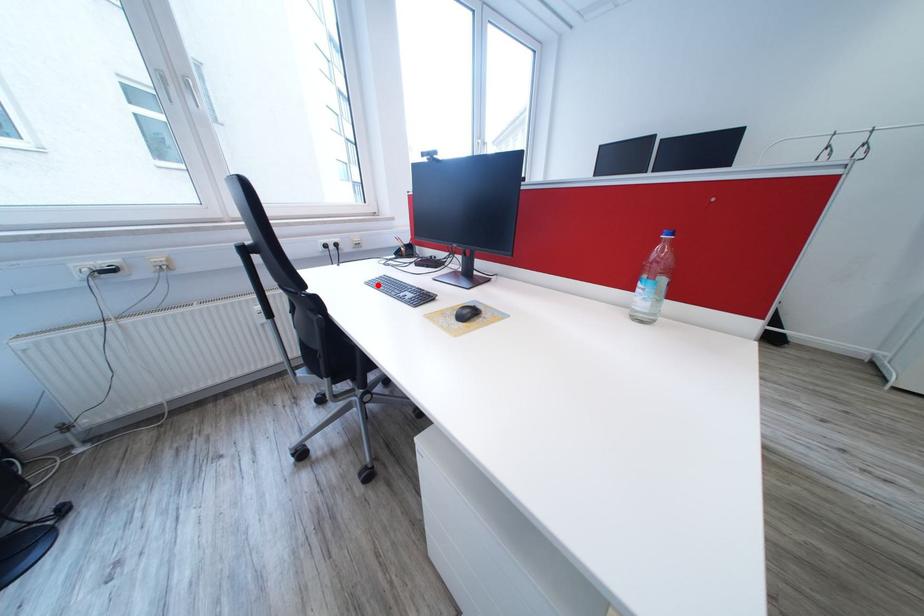
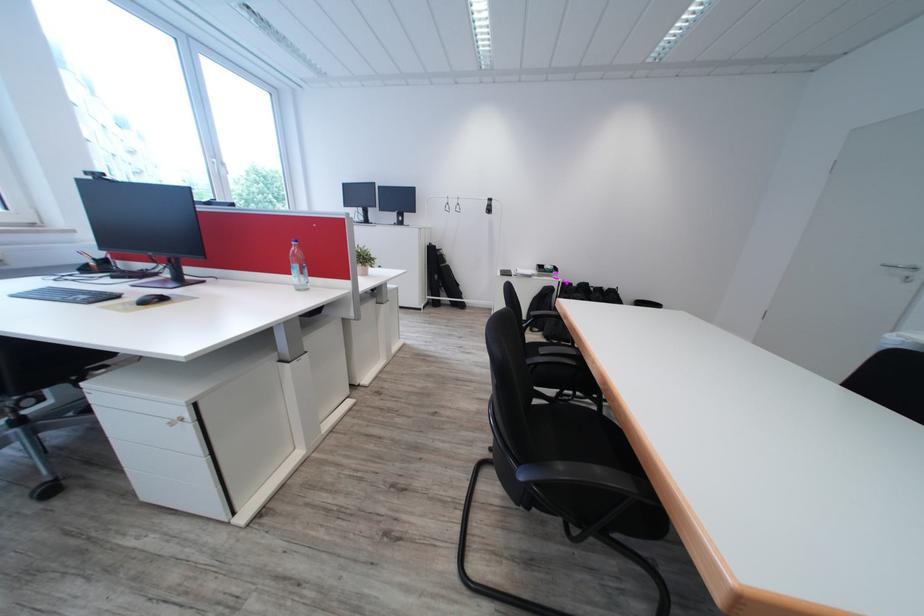
Question: I am providing you with two images of the same scene from different viewpoints. In image1, a red point is highlighted. Considering the same 3D point in image2, which of the following is correct?

Choices:
 (A) It is closer
 (B) It is farther

Answer: (B)